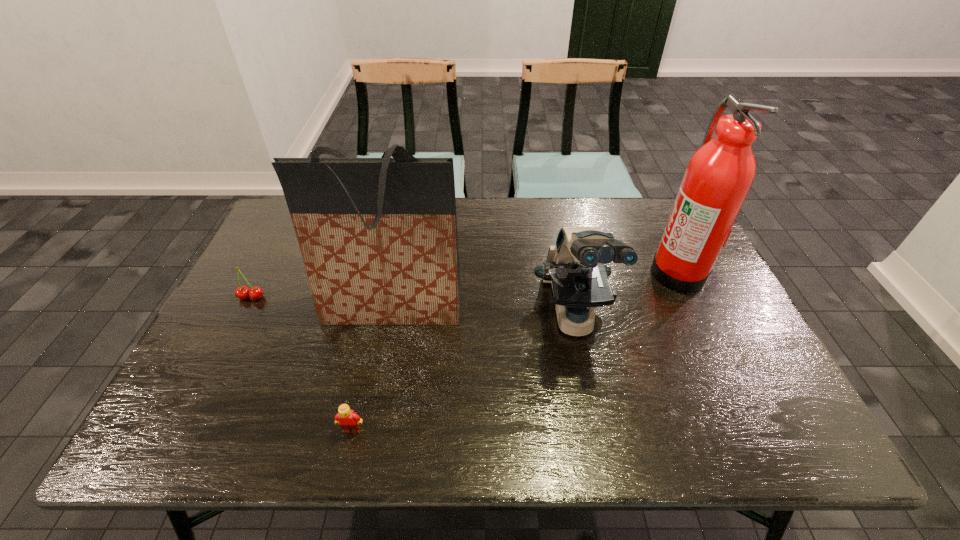
This screenshot has width=960, height=540. Identify the location of vacant space situated 0.100m through the eyepieces of the microscope. (590, 404).

This screenshot has width=960, height=540. Find the location of `vacant position located with the stems of the leftmost object pointing upwards`. vacant position located with the stems of the leftmost object pointing upwards is located at coordinates (210, 379).

Where is `object present at the near edge`? This screenshot has width=960, height=540. object present at the near edge is located at coordinates (349, 421).

The image size is (960, 540). I want to click on object at the left edge, so pyautogui.click(x=255, y=293).

You are a GUI agent. You are given a task and a screenshot of the screen. Output one action in this format:
    pyautogui.click(x=<x>, y=<y>)
    Task: Click on the object that is at the right edge
    
    Given the screenshot: What is the action you would take?
    pyautogui.click(x=719, y=175)

Image resolution: width=960 pixels, height=540 pixels. In the image, there is a desktop. In order to click on free space at the near edge in this screenshot , I will do `click(497, 431)`.

At what (x,y) coordinates should I click in order to perform the action: click on vacant region at the right edge of the desktop. Please return your answer as a coordinate pair (x, y). The width and height of the screenshot is (960, 540). Looking at the image, I should click on (732, 367).

In the image, there is a desktop. Where is `vacant area at the far left corner`? vacant area at the far left corner is located at coordinates tap(282, 235).

Where is `vacant space at the far right corner`? Image resolution: width=960 pixels, height=540 pixels. vacant space at the far right corner is located at coordinates (637, 221).

I want to click on vacant space at the near right corner of the desktop, so click(x=804, y=441).